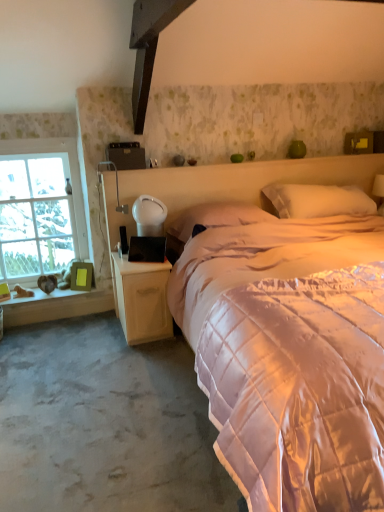
Image resolution: width=384 pixels, height=512 pixels. I want to click on free space in front of wooden nightstand at lower left, so click(x=134, y=359).